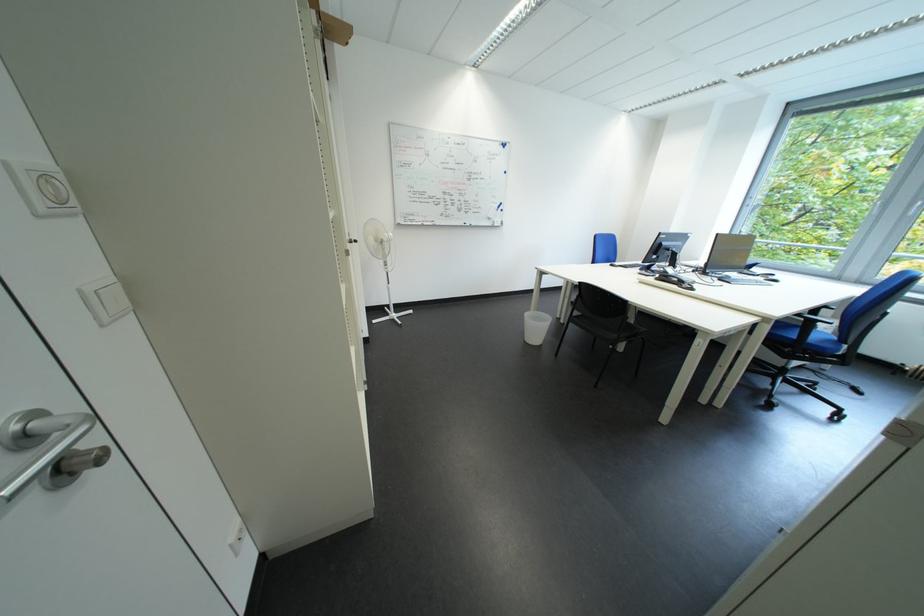
Find where to resting arm the blue chair armrest. Please return your answer as a coordinate pair (x, y).

(823, 306)